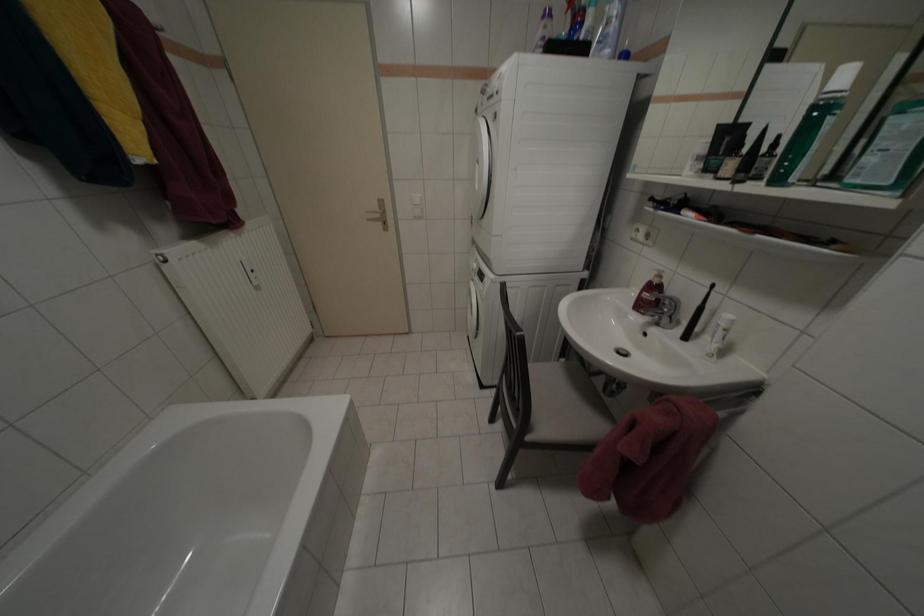
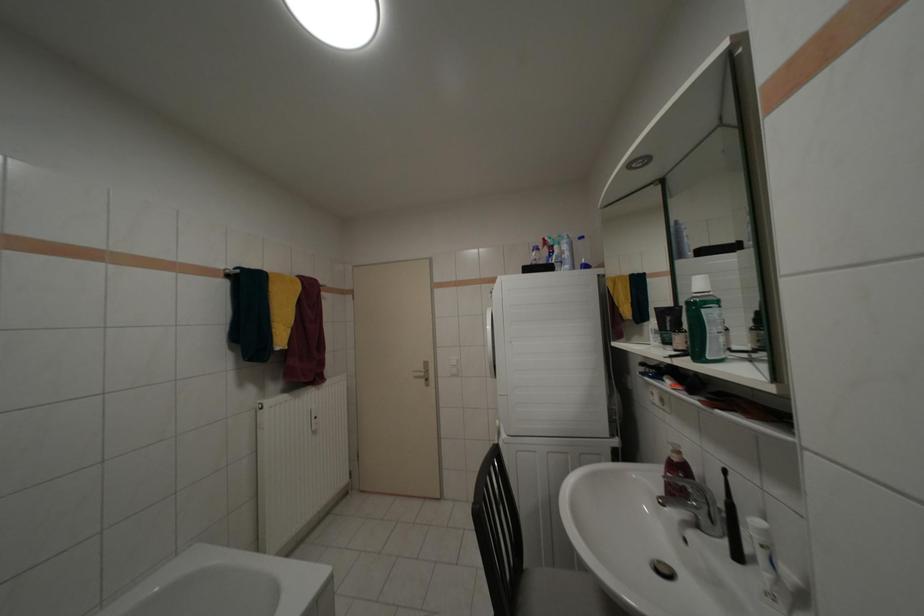
The images are taken continuously from a first-person perspective. In which direction is your viewpoint rotating?

The rotation direction of the camera is left-up.